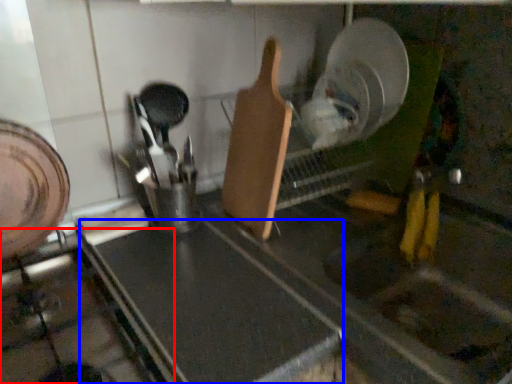
Question: Which of the following is the farthest to the observer, gas stove (highlighted by a red box) or counter top (highlighted by a blue box)?

Choices:
 (A) gas stove
 (B) counter top

Answer: (B)